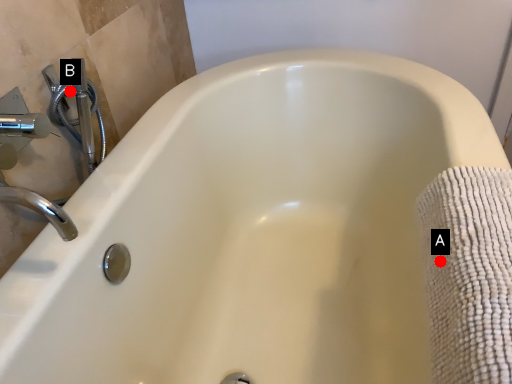
Question: Two points are circled on the image, labeled by A and B beside each circle. Among these points, which one is nearest to the camera?

Choices:
 (A) A is closer
 (B) B is closer

Answer: (A)